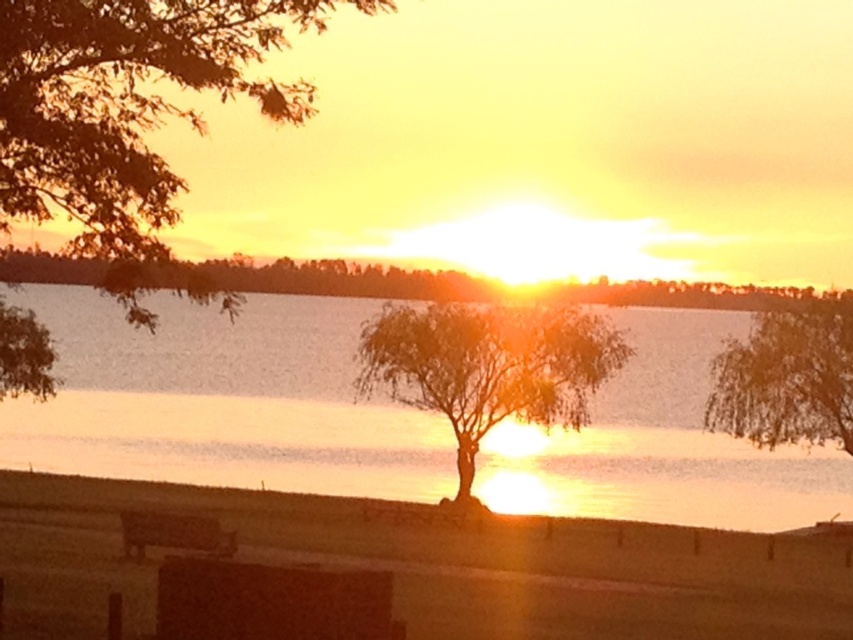
You are standing at the point marked by point [131,118] in the sunset scene. What object is directly in front of you?

The point [131,118] marks the silhouette leafy tree at upper left, so the silhouette leafy tree at upper left is directly in front of you.

From the picture: You are standing at the camera position observing the serene sunset scene. There is a point marked at coordinates point (138,276). Can you determine if this point is within a 100 feet safety zone from your current position?

The point (138,276) is 73.66 feet away from the camera, so it is within the 100 feet safety zone.

You are planning to place a small decorative statue exactly between the translucent glass water at center and the wooden park bench at lower left. Based on the scene, can you determine if the statue will fit in the space between them?

The translucent glass water at center might be wider than the wooden park bench at lower left, so the statue may or may not fit depending on the actual width of the water and bench. However, since the description only mentions a possibility, we cannot confirm for certain.